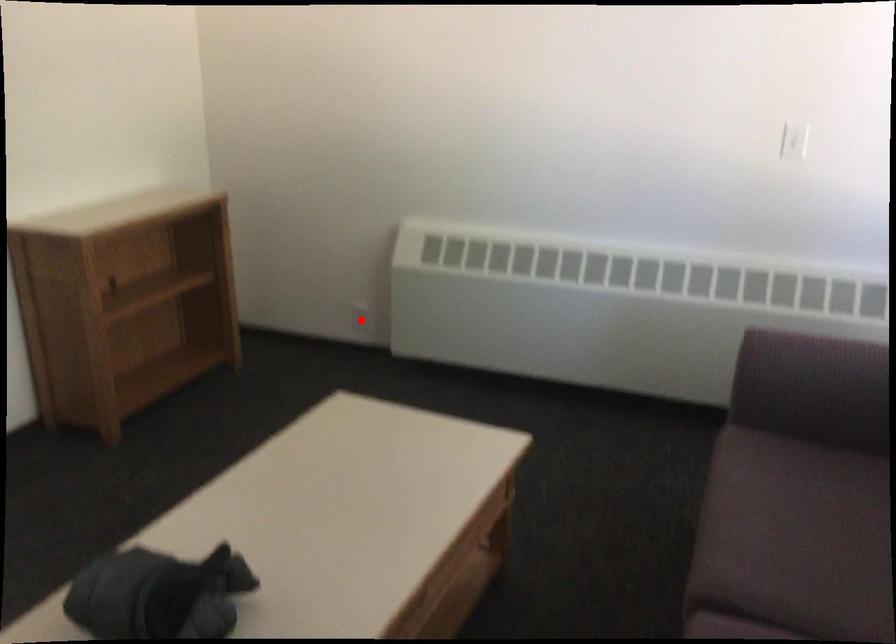
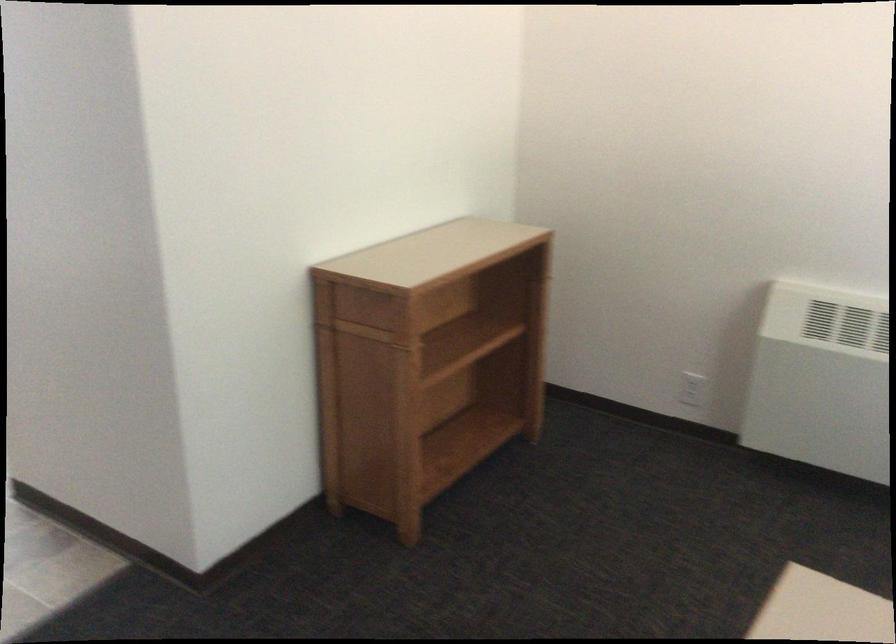
Locate, in the second image, the point that corresponds to the highlighted location in the first image.

(692, 389)